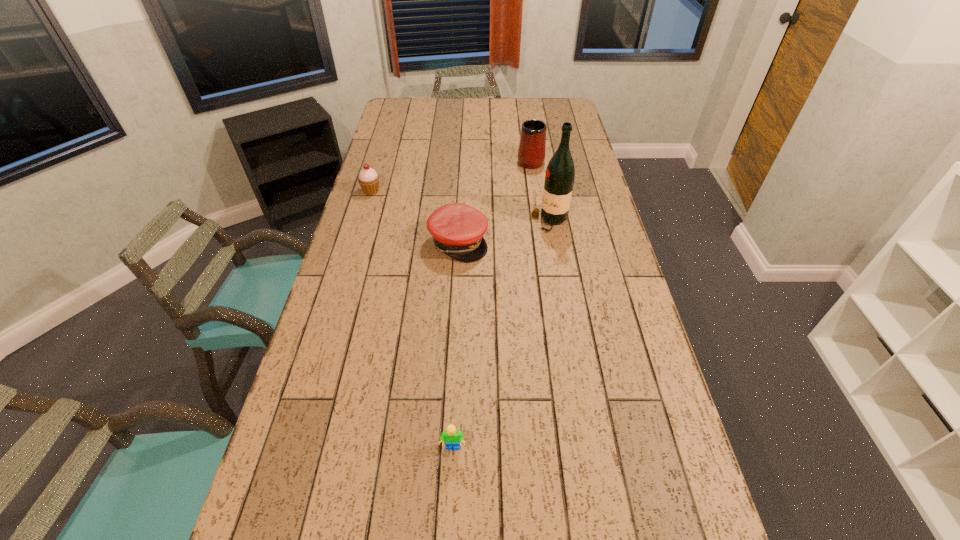
Where is `the tallest object`? The width and height of the screenshot is (960, 540). the tallest object is located at coordinates (560, 173).

In order to click on mug in this screenshot , I will do `click(531, 154)`.

Locate an element on the screen. the farthest object is located at coordinates (531, 154).

The height and width of the screenshot is (540, 960). Find the location of `the third tallest object`. the third tallest object is located at coordinates (368, 179).

This screenshot has height=540, width=960. I want to click on cupcake, so coord(368,179).

Image resolution: width=960 pixels, height=540 pixels. In order to click on cap in this screenshot , I will do `click(457, 229)`.

Image resolution: width=960 pixels, height=540 pixels. What are the coordinates of `the nearest object` in the screenshot? It's located at (451, 435).

Find the location of a particular element. This screenshot has width=960, height=540. blank space located 0.090m on the front of the tallest object is located at coordinates (555, 252).

I want to click on vacant region located on the side of the fourth shortest object with the handle, so click(525, 124).

What are the coordinates of `vacant region located 0.260m on the side of the fourth shortest object with the handle` in the screenshot? It's located at (525, 122).